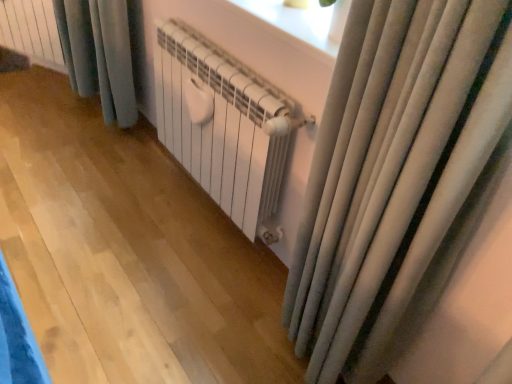
Question: From the image's perspective, is white matte radiator at upper left, positioned as the 1th radiator in top-to-bottom order, above or below white matte radiator at center, positioned as the first radiator in bottom-to-top order?

Choices:
 (A) above
 (B) below

Answer: (A)

Question: Do you think white matte radiator at upper left, which is the second radiator in right-to-left order, is within white matte radiator at center, marked as the first radiator in a front-to-back arrangement, or outside of it?

Choices:
 (A) outside
 (B) inside

Answer: (A)

Question: From a real-world perspective, is white matte radiator at upper left, placed as the 2th radiator when sorted from bottom to top, physically located above or below white matte radiator at center, which appears as the 2th radiator when viewed from the left?

Choices:
 (A) below
 (B) above

Answer: (A)

Question: In the image, is white matte radiator at center, marked as the first radiator in a front-to-back arrangement, positioned in front of or behind white matte radiator at upper left, positioned as the first radiator in back-to-front order?

Choices:
 (A) front
 (B) behind

Answer: (A)

Question: Is point (216, 130) positioned closer to the camera than point (1, 29)?

Choices:
 (A) closer
 (B) farther

Answer: (A)

Question: Is white matte radiator at center, which appears as the 2th radiator when viewed from the left, inside or outside of white matte radiator at upper left, which is the second radiator in right-to-left order?

Choices:
 (A) outside
 (B) inside

Answer: (A)

Question: From the image's perspective, is white matte radiator at center, which appears as the 2th radiator when viewed from the left, positioned above or below white matte radiator at upper left, positioned as the 1th radiator in left-to-right order?

Choices:
 (A) above
 (B) below

Answer: (B)